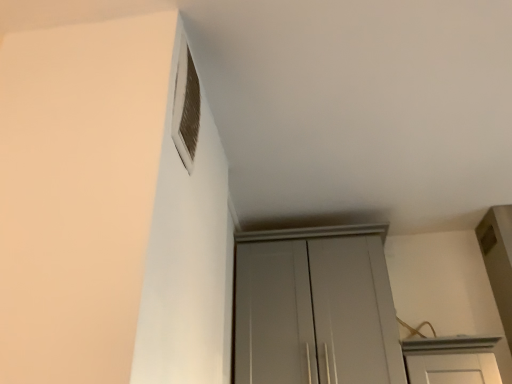
Question: Based on their positions, is white textured vent at upper left located to the left or right of matte gray cupboard at center?

Choices:
 (A) left
 (B) right

Answer: (A)

Question: Is white textured vent at upper left bigger or smaller than matte gray cupboard at center?

Choices:
 (A) big
 (B) small

Answer: (B)

Question: Do you think white textured vent at upper left is within matte gray cupboard at center, or outside of it?

Choices:
 (A) inside
 (B) outside

Answer: (B)

Question: From the image's perspective, is matte gray cupboard at center positioned above or below white textured vent at upper left?

Choices:
 (A) above
 (B) below

Answer: (B)

Question: Based on their sizes in the image, would you say matte gray cupboard at center is bigger or smaller than white textured vent at upper left?

Choices:
 (A) big
 (B) small

Answer: (A)

Question: Do you think matte gray cupboard at center is within white textured vent at upper left, or outside of it?

Choices:
 (A) inside
 (B) outside

Answer: (B)

Question: Is matte gray cupboard at center wider or thinner than white textured vent at upper left?

Choices:
 (A) wide
 (B) thin

Answer: (A)